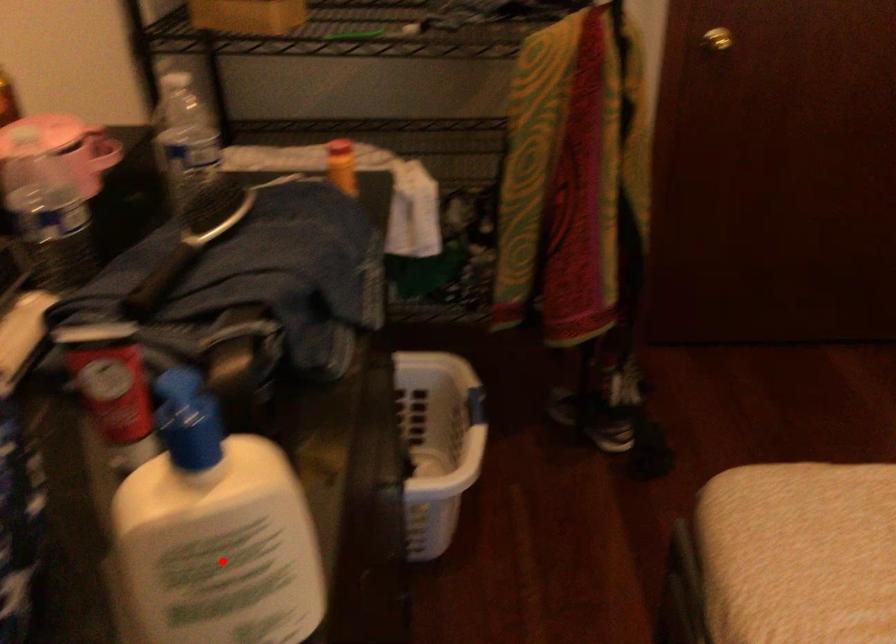
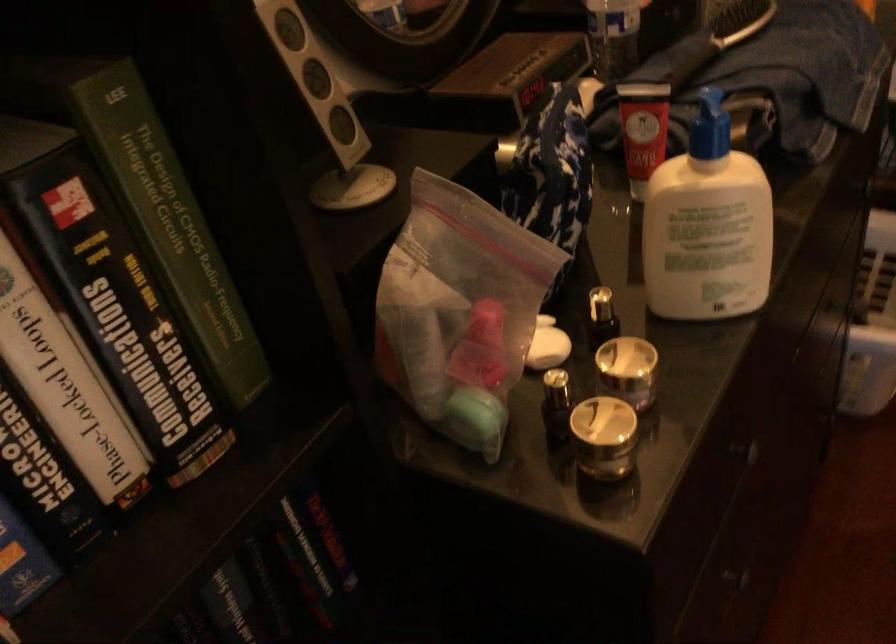
Where in the second image is the point corresponding to the highlighted location from the first image?

(707, 225)